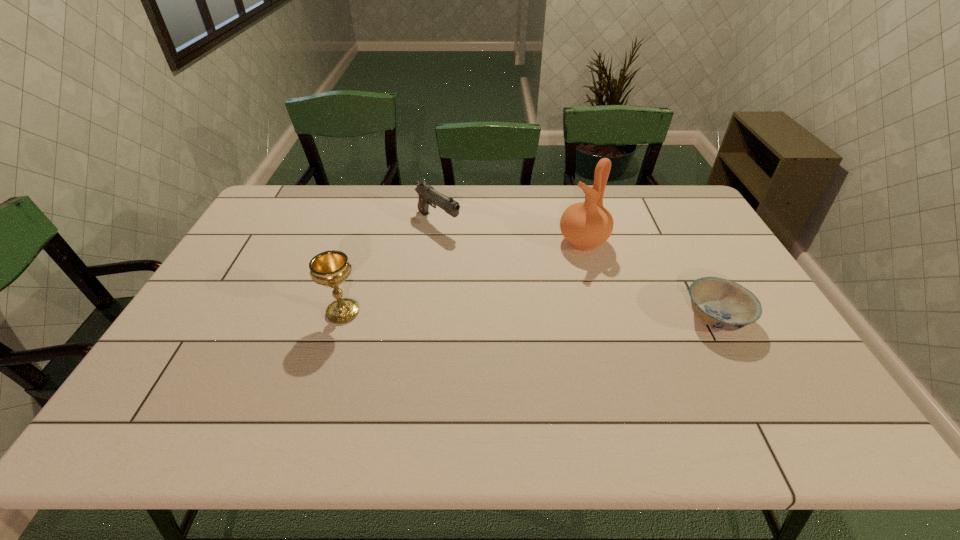
Find the location of a particular element. free spot on the desktop that is between the chalice and the rightmost object and is positioned on the spout of the pottery is located at coordinates (475, 314).

Where is `vacant spot on the desktop that is between the leftmost object and the bowl and is positioned in the direction the third object from right to left is aimed`? vacant spot on the desktop that is between the leftmost object and the bowl and is positioned in the direction the third object from right to left is aimed is located at coordinates (580, 315).